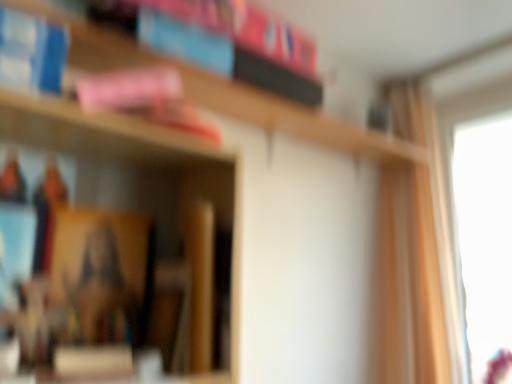
This screenshot has height=384, width=512. What do you see at coordinates (229, 94) in the screenshot?
I see `wooden bookshelf at upper center` at bounding box center [229, 94].

Measure the distance between wooden bookshelf at upper center and camera.

78.57 centimeters.

Identify the location of wooden bookshelf at upper center. (229, 94).

This screenshot has height=384, width=512. Describe the element at coordinates (417, 253) in the screenshot. I see `light beige fabric curtain at right` at that location.

You are a GUI agent. You are given a task and a screenshot of the screen. Output one action in this format:
    pyautogui.click(x=<x>, y=<y>)
    Task: Click on the light beige fabric curtain at right
    The width and height of the screenshot is (512, 384).
    Given the screenshot: What is the action you would take?
    pyautogui.click(x=417, y=253)

Find the location of a particular element. The height and width of the screenshot is (384, 512). wooden bookshelf at upper center is located at coordinates (229, 94).

Which is more to the left, wooden bookshelf at upper center or light beige fabric curtain at right?

From the viewer's perspective, wooden bookshelf at upper center appears more on the left side.

Which object is closer to the camera, wooden bookshelf at upper center or light beige fabric curtain at right?

wooden bookshelf at upper center.

Is point (405, 151) farther from camera compared to point (387, 229)?

No, it is in front of (387, 229).

From the image's perspective, which is above, wooden bookshelf at upper center or light beige fabric curtain at right?

wooden bookshelf at upper center.

From a real-world perspective, is wooden bookshelf at upper center physically above light beige fabric curtain at right?

Yes, from a real-world perspective, wooden bookshelf at upper center is above light beige fabric curtain at right.

Considering the sizes of objects wooden bookshelf at upper center and light beige fabric curtain at right in the image provided, who is thinner, wooden bookshelf at upper center or light beige fabric curtain at right?

light beige fabric curtain at right.

Between wooden bookshelf at upper center and light beige fabric curtain at right, which one has more height?

With more height is light beige fabric curtain at right.

Between wooden bookshelf at upper center and light beige fabric curtain at right, which one has smaller size?

With smaller size is wooden bookshelf at upper center.

Is wooden bookshelf at upper center surrounding light beige fabric curtain at right?

No, light beige fabric curtain at right is not inside wooden bookshelf at upper center.

Is wooden bookshelf at upper center in contact with light beige fabric curtain at right?

No, wooden bookshelf at upper center is not in contact with light beige fabric curtain at right.

Is wooden bookshelf at upper center oriented away from light beige fabric curtain at right?

wooden bookshelf at upper center does not have its back to light beige fabric curtain at right.

This screenshot has height=384, width=512. What are the coordinates of `bookcase on the left of the light beige fabric curtain at right` in the screenshot? It's located at (229, 94).

Considering the positions of objects light beige fabric curtain at right and wooden bookshelf at upper center in the image provided, who is more to the left, light beige fabric curtain at right or wooden bookshelf at upper center?

wooden bookshelf at upper center.

Is light beige fabric curtain at right positioned in front of wooden bookshelf at upper center?

No, light beige fabric curtain at right is behind wooden bookshelf at upper center.

Which is closer to the camera, (421, 298) or (390, 161)?

Positioned in front is point (421, 298).

From the image's perspective, which is below, light beige fabric curtain at right or wooden bookshelf at upper center?

light beige fabric curtain at right.

Consider the image. From a real-world perspective, does light beige fabric curtain at right stand above wooden bookshelf at upper center?

Incorrect, from a real-world perspective, light beige fabric curtain at right is lower than wooden bookshelf at upper center.

Between light beige fabric curtain at right and wooden bookshelf at upper center, which one has larger width?

wooden bookshelf at upper center is wider.

Does light beige fabric curtain at right have a lesser height compared to wooden bookshelf at upper center?

Incorrect, the height of light beige fabric curtain at right does not fall short of that of wooden bookshelf at upper center.

Is light beige fabric curtain at right bigger or smaller than wooden bookshelf at upper center?

In the image, light beige fabric curtain at right appears to be larger than wooden bookshelf at upper center.

Is light beige fabric curtain at right not within wooden bookshelf at upper center?

light beige fabric curtain at right lies outside wooden bookshelf at upper center's area.

Can you see light beige fabric curtain at right touching wooden bookshelf at upper center?

They are not placed beside each other.

Based on the photo, is wooden bookshelf at upper center at the back of light beige fabric curtain at right?

No, wooden bookshelf at upper center is not at the back of light beige fabric curtain at right.

How different are the orientations of light beige fabric curtain at right and wooden bookshelf at upper center in degrees?

There is a 95.7-degree angle between the facing directions of light beige fabric curtain at right and wooden bookshelf at upper center.

The width and height of the screenshot is (512, 384). Find the location of `curtain behind the wooden bookshelf at upper center`. curtain behind the wooden bookshelf at upper center is located at coordinates (417, 253).

This screenshot has height=384, width=512. Find the location of `bookcase above the light beige fabric curtain at right (from the image's perspective)`. bookcase above the light beige fabric curtain at right (from the image's perspective) is located at coordinates (229, 94).

Identify the location of bookcase in front of the light beige fabric curtain at right. (229, 94).